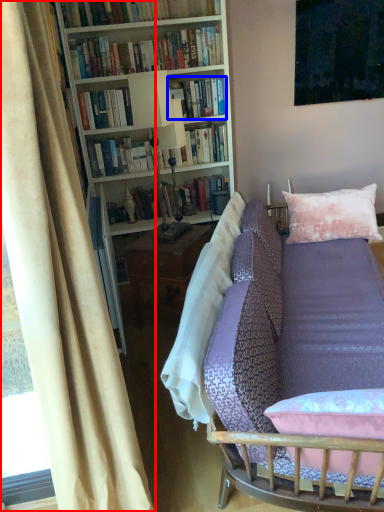
Question: Which point is further to the camera, curtain (highlighted by a red box) or book (highlighted by a blue box)?

Choices:
 (A) curtain
 (B) book

Answer: (B)